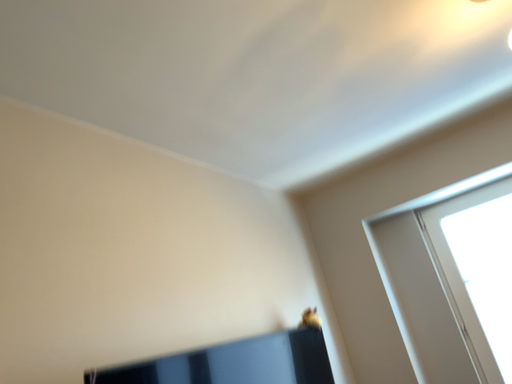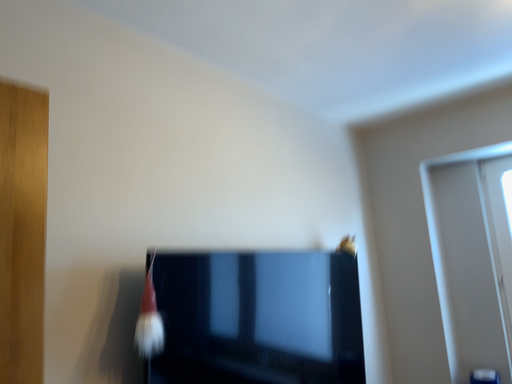
Question: Which way did the camera rotate in the video?

Choices:
 (A) rotated upward
 (B) rotated downward

Answer: (B)